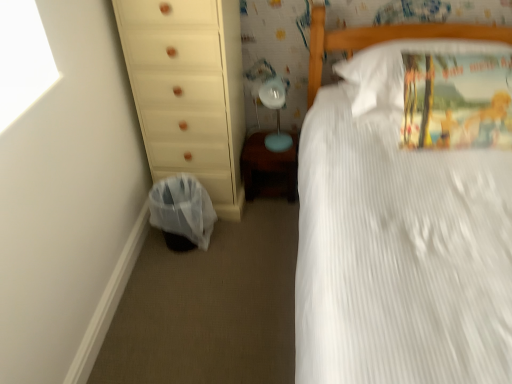
This screenshot has height=384, width=512. I want to click on vacant space that's between white wood chest of drawers at left and plastic bag at lower left, so click(x=220, y=236).